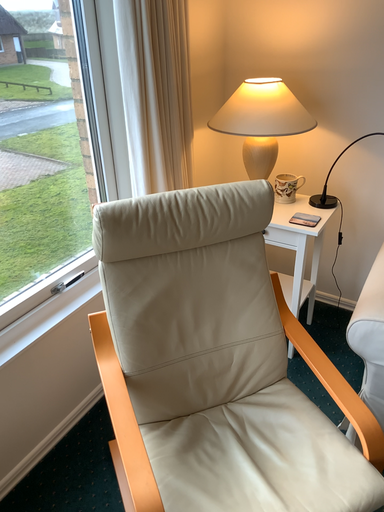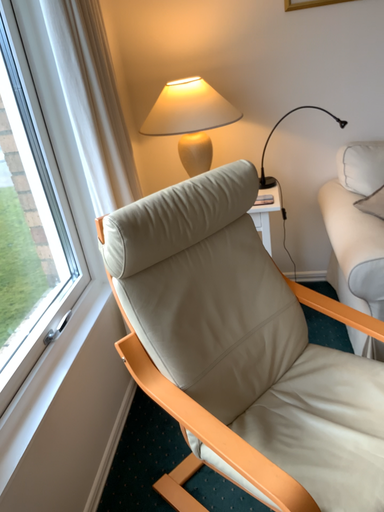
Question: How did the camera likely rotate when shooting the video?

Choices:
 (A) rotated downward
 (B) rotated upward

Answer: (B)